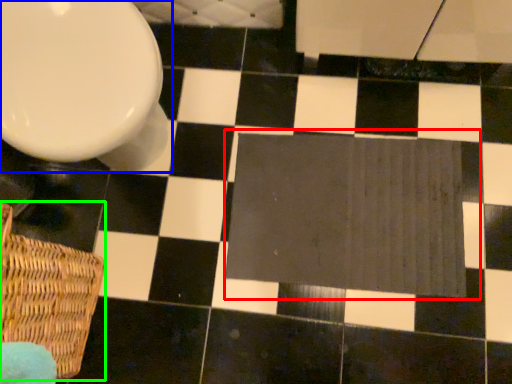
Question: Which is farther away from bath mat (highlighted by a red box)? toilet (highlighted by a blue box) or basket (highlighted by a green box)?

Choices:
 (A) toilet
 (B) basket

Answer: (B)